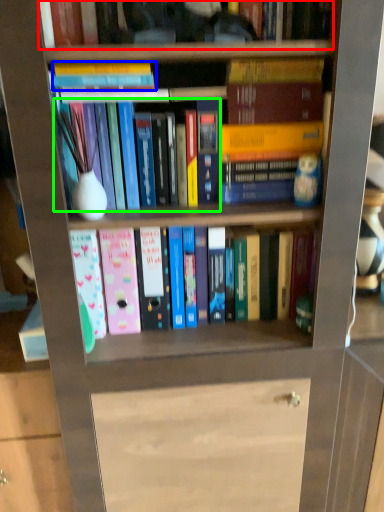
Question: Based on their relative distances, which object is farther from book (highlighted by a red box)? Choose from book (highlighted by a blue box) and book (highlighted by a green box).

Choices:
 (A) book
 (B) book

Answer: (B)